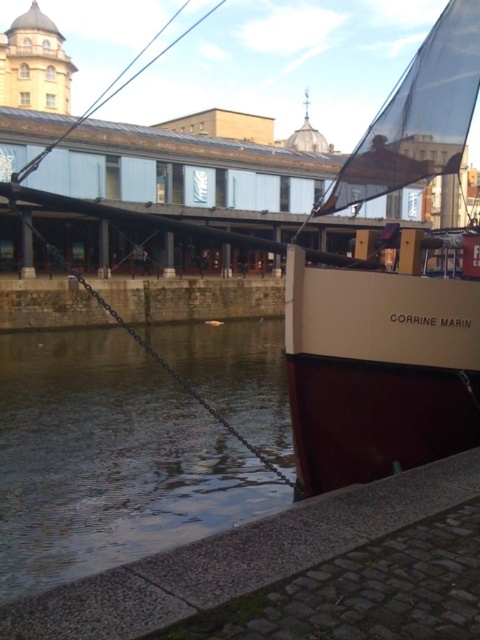
Who is positioned more to the left, smooth water at lower left or beige matte sailboat at right?

smooth water at lower left is more to the left.

Between point (279, 506) and point (383, 444), which one is positioned behind?

The point (279, 506) is more distant.

Identify the location of smooth water at lower left. The width and height of the screenshot is (480, 640). (108, 460).